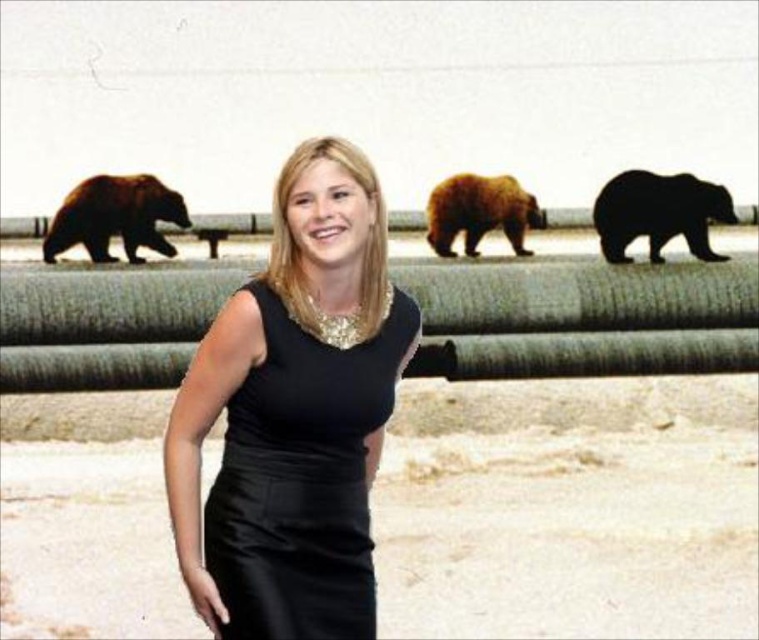
Question: Which point is farther from the camera taking this photo?

Choices:
 (A) (332, 520)
 (B) (712, 205)
 (C) (159, 216)

Answer: (C)

Question: Is black fur bear at upper center closer to camera compared to brown furry bear at left?

Choices:
 (A) no
 (B) yes

Answer: (B)

Question: Is black satin dress at center positioned in front of brown furry bear at left?

Choices:
 (A) no
 (B) yes

Answer: (B)

Question: Which object is farther from the camera taking this photo?

Choices:
 (A) black fur bear at upper center
 (B) brown furry bear at left
 (C) black satin dress at center

Answer: (B)

Question: Which object is farther from the camera taking this photo?

Choices:
 (A) black fur bear at upper center
 (B) brown furry bear at left
 (C) black satin dress at center
 (D) brown furry bear at center

Answer: (D)

Question: Is black satin dress at center wider than brown furry bear at center?

Choices:
 (A) no
 (B) yes

Answer: (A)